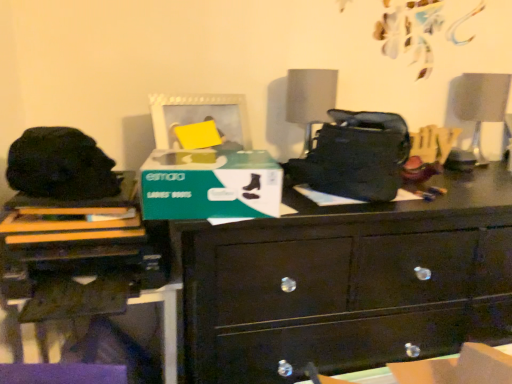
Question: Does matte gray lampshade at center lie behind green matte cardboard box at center?

Choices:
 (A) no
 (B) yes

Answer: (B)

Question: Considering the relative positions of matte gray lampshade at center and green matte cardboard box at center in the image provided, is matte gray lampshade at center to the right of green matte cardboard box at center from the viewer's perspective?

Choices:
 (A) yes
 (B) no

Answer: (A)

Question: From a real-world perspective, is matte gray lampshade at center physically above green matte cardboard box at center?

Choices:
 (A) yes
 (B) no

Answer: (A)

Question: Is the depth of matte gray lampshade at center less than that of green matte cardboard box at center?

Choices:
 (A) yes
 (B) no

Answer: (B)

Question: Can you confirm if matte gray lampshade at center is wider than green matte cardboard box at center?

Choices:
 (A) yes
 (B) no

Answer: (B)

Question: Does matte gray lampshade at center appear on the left side of green matte cardboard box at center?

Choices:
 (A) no
 (B) yes

Answer: (A)

Question: Is green matte cardboard box at center not near white glossy swivel chair at upper right?

Choices:
 (A) no
 (B) yes

Answer: (A)

Question: Could you tell me if green matte cardboard box at center is facing white glossy swivel chair at upper right?

Choices:
 (A) yes
 (B) no

Answer: (B)

Question: From a real-world perspective, is green matte cardboard box at center located higher than white glossy swivel chair at upper right?

Choices:
 (A) no
 (B) yes

Answer: (A)

Question: Is green matte cardboard box at center bigger than white glossy swivel chair at upper right?

Choices:
 (A) no
 (B) yes

Answer: (B)

Question: From the image's perspective, would you say green matte cardboard box at center is positioned over white glossy swivel chair at upper right?

Choices:
 (A) yes
 (B) no

Answer: (B)

Question: Is white glossy swivel chair at upper right a part of green matte cardboard box at center?

Choices:
 (A) yes
 (B) no

Answer: (B)

Question: Considering the relative sizes of white matte picture frame at upper center and matte black printer at lower left in the image provided, is white matte picture frame at upper center smaller than matte black printer at lower left?

Choices:
 (A) no
 (B) yes

Answer: (B)